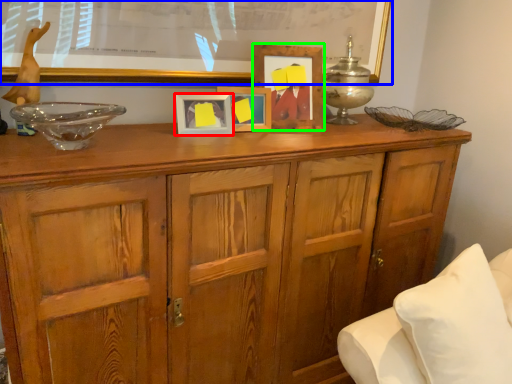
Question: Which is nearer to the picture frame (highlighted by a red box)? bulletin board (highlighted by a blue box) or picture frame (highlighted by a green box).

Choices:
 (A) bulletin board
 (B) picture frame

Answer: (B)